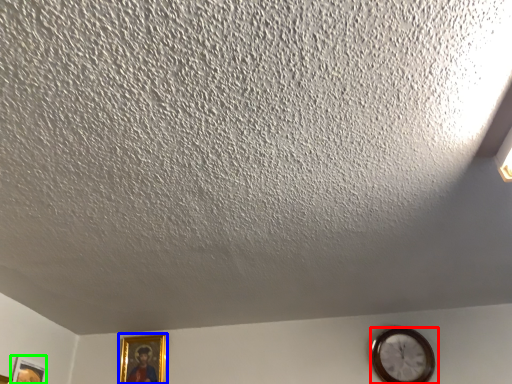
Question: Which object is positioned farthest from wall clock (highlighted by a red box)? Select from picture frame (highlighted by a blue box) and picture frame (highlighted by a green box).

Choices:
 (A) picture frame
 (B) picture frame

Answer: (B)